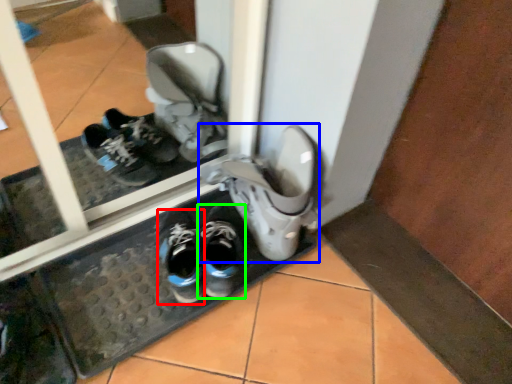
Question: Which is farther away from running shoe (highlighted by a red box)? footwear (highlighted by a blue box) or footwear (highlighted by a green box)?

Choices:
 (A) footwear
 (B) footwear

Answer: (A)